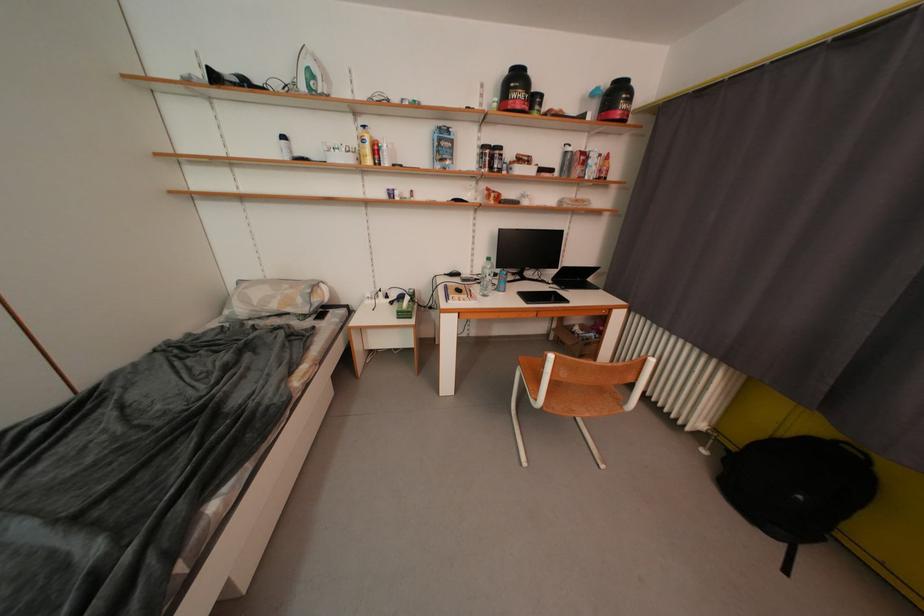
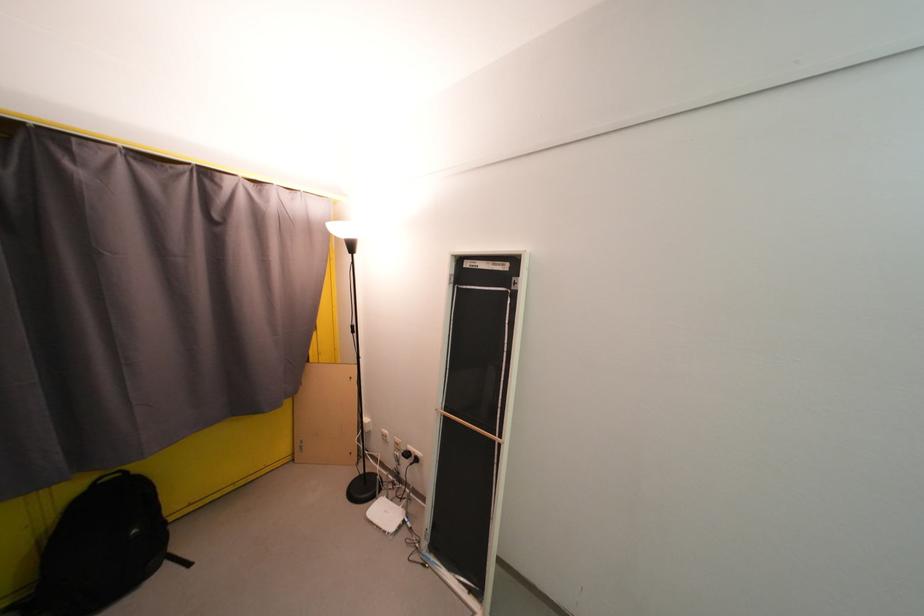
Locate, in the second image, the point that corresponds to point (878, 466) in the first image.

(134, 476)